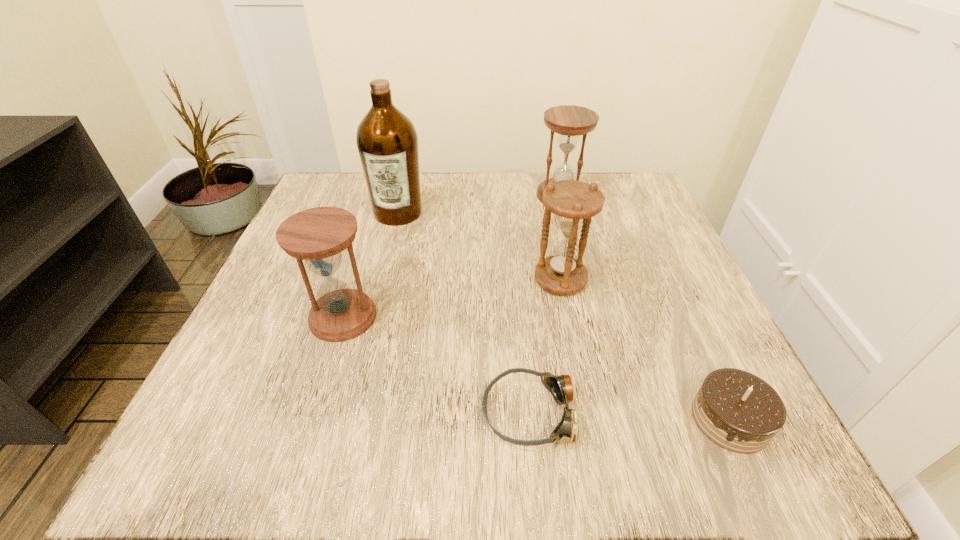
Locate an element on the screen. the tallest object is located at coordinates (387, 141).

Identify the location of the farthest hourglass. The image size is (960, 540). (569, 121).

You are a GUI agent. You are given a task and a screenshot of the screen. Output one action in this format:
    pyautogui.click(x=<x>, y=<y>)
    Task: Click on the leftmost hourglass
    
    Given the screenshot: What is the action you would take?
    pyautogui.click(x=318, y=236)

Locate an element on the screen. Image resolution: width=960 pixels, height=540 pixels. the rightmost object is located at coordinates coord(738,411).

Where is `the second shortest object`? Image resolution: width=960 pixels, height=540 pixels. the second shortest object is located at coordinates (738, 411).

The image size is (960, 540). Identify the location of the shortest object. [560, 386].

This screenshot has height=540, width=960. I want to click on vacant position located 0.310m on the label of the tallest object, so click(x=367, y=340).

Where is `vacant area situated 0.400m on the left of the farthest hourglass`? vacant area situated 0.400m on the left of the farthest hourglass is located at coordinates (367, 195).

At what (x,y) coordinates should I click in order to perform the action: click on free location located 0.070m on the left of the leftmost hourglass. Please return your answer as a coordinate pair (x, y). Looking at the image, I should click on (269, 316).

Find the location of a particular element. Image resolution: width=960 pixels, height=540 pixels. vacant space positioned on the left of the second shortest object is located at coordinates click(x=600, y=419).